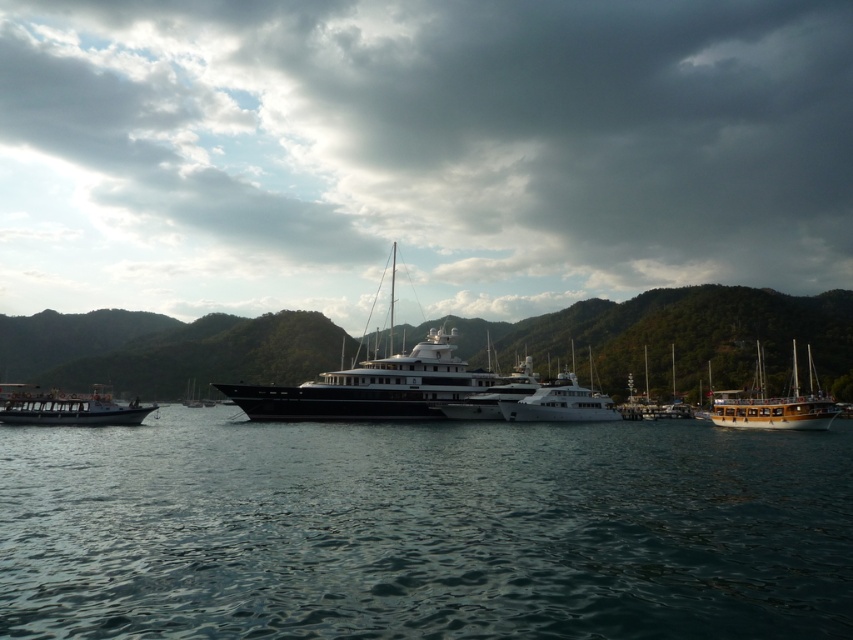
Is point (44, 403) less distant than point (538, 404)?

That is True.

Is metallic gray boat at left to the right of white glossy yacht at center from the viewer's perspective?

In fact, metallic gray boat at left is to the left of white glossy yacht at center.

Which is behind, point (105, 403) or point (618, 419)?

The point (618, 419) is behind.

Locate an element on the screen. metallic gray boat at left is located at coordinates (67, 406).

Can you confirm if cloudy sky at upper center is thinner than white glossy yacht at center?

No, cloudy sky at upper center is not thinner than white glossy yacht at center.

Does cloudy sky at upper center lie behind white glossy yacht at center?

Yes, cloudy sky at upper center is behind white glossy yacht at center.

Does point (345, 16) lie behind point (611, 404)?

Yes, it is.

This screenshot has width=853, height=640. What are the coordinates of `cloudy sky at upper center` in the screenshot? It's located at (418, 150).

Is cloudy sky at upper center to the right of wooden sailboat at right from the viewer's perspective?

No, cloudy sky at upper center is not to the right of wooden sailboat at right.

Does cloudy sky at upper center have a larger size compared to wooden sailboat at right?

Yes, cloudy sky at upper center is bigger than wooden sailboat at right.

Which is in front, point (204, 252) or point (793, 422)?

Positioned in front is point (793, 422).

This screenshot has height=640, width=853. Find the location of `cloudy sky at upper center`. cloudy sky at upper center is located at coordinates (418, 150).